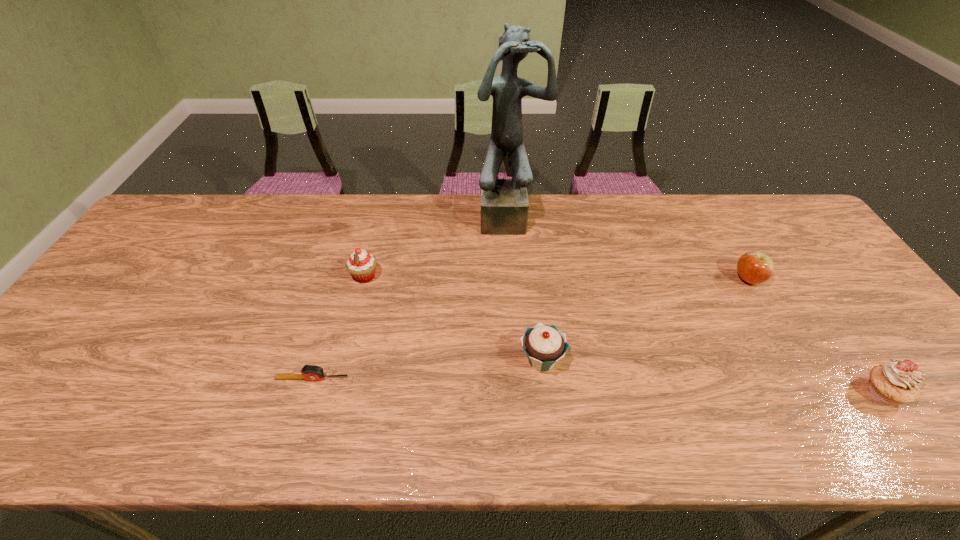
Identify the location of free point between the tallest object and the second cupcake from left to right. (525, 288).

Find the location of a particular element. This screenshot has height=540, width=960. free spot between the second object from right to left and the second cupcake from right to left is located at coordinates (645, 320).

Select which object appears as the third closest to the tape measure. Please provide its 2D coordinates. Your answer should be formatted as a tuple, i.e. [(x, y)], where the tuple contains the x and y coordinates of a point satisfying the conditions above.

[(504, 202)]

Where is `the second closest object relative to the second cupcake from right to left`? The width and height of the screenshot is (960, 540). the second closest object relative to the second cupcake from right to left is located at coordinates (309, 372).

Locate which cupcake ranks in proximity to the second cupcake from right to left. Please provide its 2D coordinates. Your answer should be formatted as a tuple, i.e. [(x, y)], where the tuple contains the x and y coordinates of a point satisfying the conditions above.

[(361, 265)]

What are the coordinates of `cupcake that can be found as the second closest to the second cupcake from left to right` in the screenshot? It's located at (896, 382).

Find the location of `vacant space that satisfies the following two spatial constraints: 1. on the face of the rightmost object; 2. on the right side of the tallest object`. vacant space that satisfies the following two spatial constraints: 1. on the face of the rightmost object; 2. on the right side of the tallest object is located at coordinates (522, 393).

This screenshot has height=540, width=960. I want to click on free location that satisfies the following two spatial constraints: 1. on the face of the sculpture; 2. on the right side of the second cupcake from left to right, so click(x=519, y=360).

The height and width of the screenshot is (540, 960). Identify the location of free location that satisfies the following two spatial constraints: 1. on the face of the second cupcake from right to left; 2. on the right side of the tallest object. (519, 360).

At what (x,y) coordinates should I click in order to perform the action: click on blank space that satisfies the following two spatial constraints: 1. on the front side of the second cupcake from right to left; 2. on the left side of the rightmost cupcake. Please return your answer as a coordinate pair (x, y). Looking at the image, I should click on (545, 393).